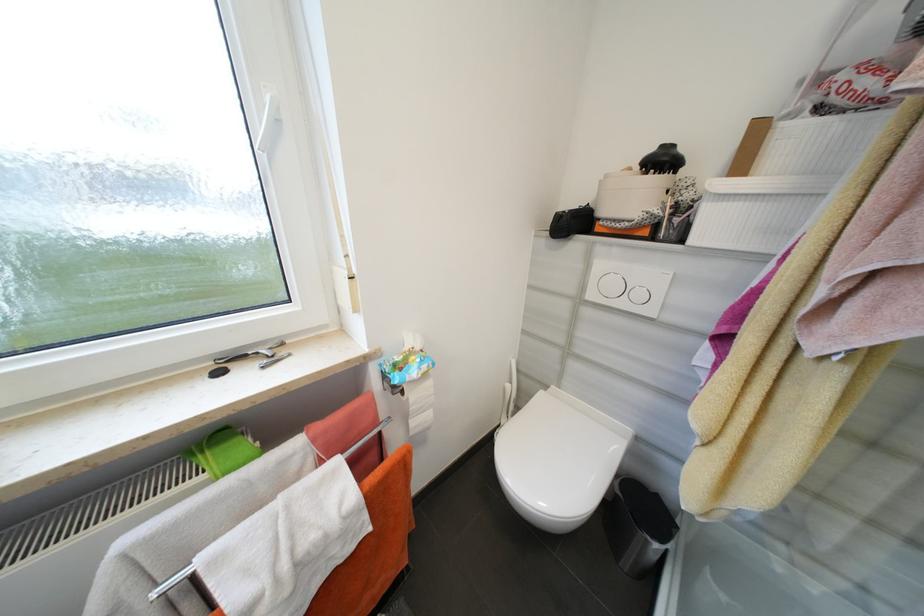
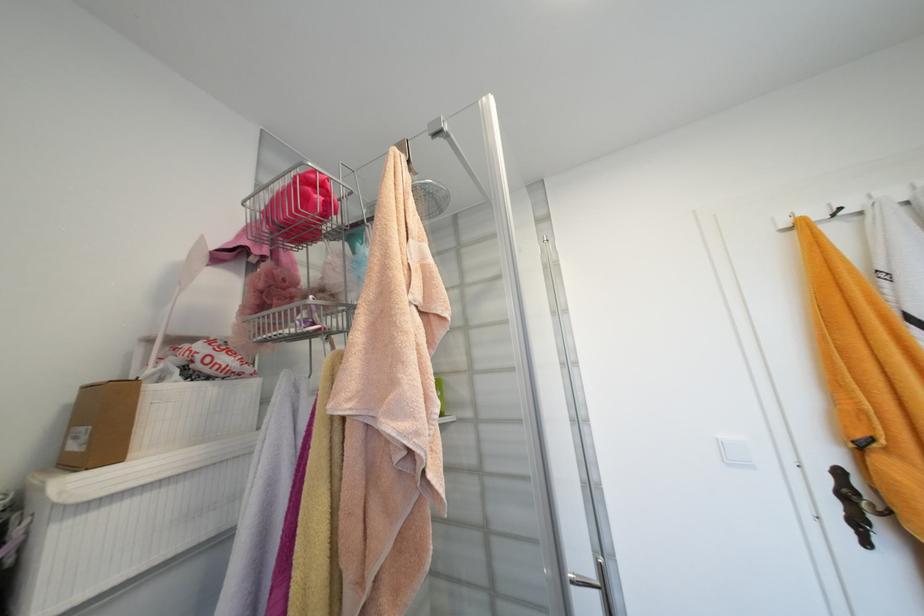
Question: The camera is either moving clockwise (left) or counter-clockwise (right) around the object. The first image is from the beginning of the video and the second image is from the end. Is the camera moving left or right when shooting the video?

Choices:
 (A) Left
 (B) Right

Answer: (A)